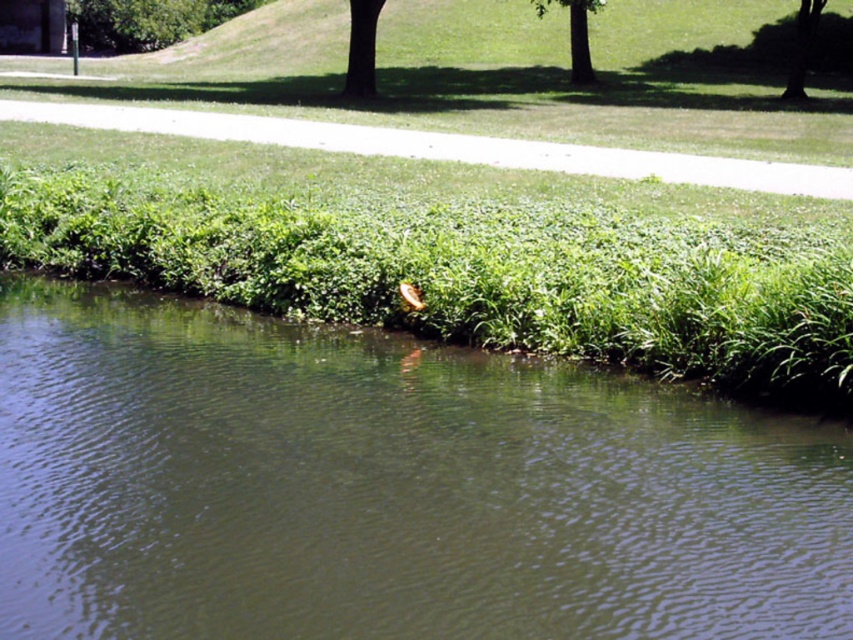
You are standing at the edge of the green grassy river at center and want to reach the green leafy tree at upper center. Which direction should you walk to get closer to the tree?

Since the green grassy river at center is shorter than the green leafy tree at upper center, you should walk towards the upper direction to reach the tree.

You are standing at the entrance of the pathway and want to walk towards the green leafy tree at upper right. Which direction should you head relative to the green leafy tree at upper center?

You should head to the right of the green leafy tree at upper center because the green leafy tree at upper right is located to the right of the green leafy tree at upper center.